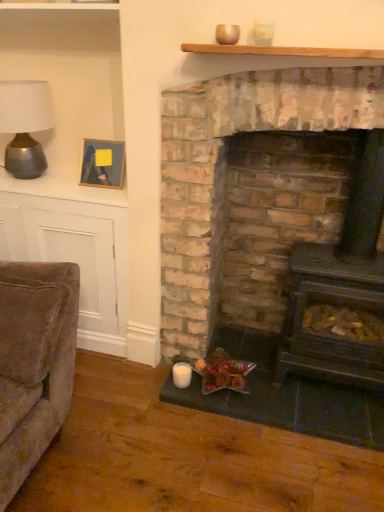
Identify the location of brick fireplace at center. Image resolution: width=384 pixels, height=512 pixels. pyautogui.click(x=259, y=231).

Describe the element at coordinates (103, 163) in the screenshot. This screenshot has height=512, width=384. I see `wooden picture frame at upper left` at that location.

I want to click on shiny brown nuts at lower center, so click(x=223, y=373).

You are a GUI agent. You are given a task and a screenshot of the screen. Output one action in this format:
    pyautogui.click(x=<x>, y=<y>)
    Task: Click on the wooden mantle at upper center
    This screenshot has width=384, height=512.
    Given the screenshot: What is the action you would take?
    pyautogui.click(x=283, y=51)

What is the approximate width of matte silver table lamp at left?

matte silver table lamp at left is 14.82 inches wide.

Image resolution: width=384 pixels, height=512 pixels. In order to click on dark gray cast iron wood burning stove at center in this screenshot , I will do `click(341, 283)`.

This screenshot has height=512, width=384. In order to click on brick fireplace at center in this screenshot , I will do `click(259, 231)`.

From the image's perspective, does shiny brown nuts at lower center appear higher than matte silver table lamp at left?

Actually, shiny brown nuts at lower center appears below matte silver table lamp at left in the image.

How much distance is there between shiny brown nuts at lower center and matte silver table lamp at left?

A distance of 1.33 meters exists between shiny brown nuts at lower center and matte silver table lamp at left.

Which is more to the left, shiny brown nuts at lower center or matte silver table lamp at left?

matte silver table lamp at left is more to the left.

Looking at this image, can you confirm if shiny brown nuts at lower center is smaller than matte silver table lamp at left?

Correct, shiny brown nuts at lower center occupies less space than matte silver table lamp at left.

Which is nearer, (300, 388) or (331, 296)?

Positioned in front is point (331, 296).

Is brick fireplace at center turned away from dark gray cast iron wood burning stove at center?

That's right, brick fireplace at center is facing away from dark gray cast iron wood burning stove at center.

From the image's perspective, is brick fireplace at center above or below dark gray cast iron wood burning stove at center?

Clearly, from the image's perspective, brick fireplace at center is above dark gray cast iron wood burning stove at center.

Considering the sizes of matte silver table lamp at left and shiny brown nuts at lower center in the image, is matte silver table lamp at left bigger or smaller than shiny brown nuts at lower center?

Considering their sizes, matte silver table lamp at left takes up more space than shiny brown nuts at lower center.

In the scene shown: From the image's perspective, between matte silver table lamp at left and shiny brown nuts at lower center, who is located below?

From the image's view, shiny brown nuts at lower center is below.

Looking at this image, does matte silver table lamp at left come in front of shiny brown nuts at lower center?

Yes, the depth of matte silver table lamp at left is less than that of shiny brown nuts at lower center.

Does wooden picture frame at upper left appear on the left side of shiny brown nuts at lower center?

Yes, wooden picture frame at upper left is to the left of shiny brown nuts at lower center.

Find the location of a particular element. food below the wooden picture frame at upper left (from the image's perspective) is located at coordinates (223, 373).

Is wooden picture frame at upper left facing towards shiny brown nuts at lower center?

No.

From a real-world perspective, which is physically above, matte silver table lamp at left or wooden mantle at upper center?

wooden mantle at upper center.

In the scene shown: Would you say matte silver table lamp at left is inside or outside wooden mantle at upper center?

matte silver table lamp at left is spatially situated outside wooden mantle at upper center.

Which object is further away from the camera, matte silver table lamp at left or wooden mantle at upper center?

matte silver table lamp at left is more distant.

Where is `mantle lying in front of the matte silver table lamp at left`? The width and height of the screenshot is (384, 512). mantle lying in front of the matte silver table lamp at left is located at coordinates (283, 51).

From the picture: Are shiny brown nuts at lower center and wooden mantle at upper center beside each other?

shiny brown nuts at lower center is not next to wooden mantle at upper center, and they're not touching.

Does shiny brown nuts at lower center contain wooden mantle at upper center?

No, shiny brown nuts at lower center does not contain wooden mantle at upper center.

Does point (216, 365) lie in front of point (349, 57)?

No, it is behind (349, 57).

Does shiny brown nuts at lower center appear on the left side of wooden mantle at upper center?

Indeed, shiny brown nuts at lower center is positioned on the left side of wooden mantle at upper center.

From the image's perspective, would you say wooden mantle at upper center is shown under brick fireplace at center?

No.

In terms of width, does wooden mantle at upper center look wider or thinner when compared to brick fireplace at center?

wooden mantle at upper center is thinner than brick fireplace at center.

From a real-world perspective, relative to brick fireplace at center, is wooden mantle at upper center vertically above or below?

In terms of real-world spatial position, wooden mantle at upper center is above brick fireplace at center.

Are wooden mantle at upper center and brick fireplace at center beside each other?

wooden mantle at upper center and brick fireplace at center are not in contact.

Where is `table lamp on the left of shiny brown nuts at lower center`? The width and height of the screenshot is (384, 512). table lamp on the left of shiny brown nuts at lower center is located at coordinates (25, 125).

Identify the location of wood burning stove lying on the right of brick fireplace at center. (341, 283).

Looking at the image, which one is located further to dark gray cast iron wood burning stove at center, matte silver table lamp at left or wooden picture frame at upper left?

matte silver table lamp at left is positioned further to the anchor dark gray cast iron wood burning stove at center.

Looking at the image, which one is located further to shiny brown nuts at lower center, matte silver table lamp at left or brick fireplace at center?

matte silver table lamp at left.

Which object lies nearer to the anchor point brick fireplace at center, wooden picture frame at upper left or wooden mantle at upper center?

Among the two, wooden picture frame at upper left is located nearer to brick fireplace at center.

Looking at the image, which one is located further to wooden picture frame at upper left, shiny brown nuts at lower center or dark gray cast iron wood burning stove at center?

Among the two, dark gray cast iron wood burning stove at center is located further to wooden picture frame at upper left.

Based on the photo, considering their positions, is brick fireplace at center positioned closer to wooden picture frame at upper left than matte silver table lamp at left?

Among the two, matte silver table lamp at left is located nearer to wooden picture frame at upper left.

Estimate the real-world distances between objects in this image. Which object is further from dark gray cast iron wood burning stove at center, brick fireplace at center or wooden picture frame at upper left?

wooden picture frame at upper left is positioned further to the anchor dark gray cast iron wood burning stove at center.

From the image, which object appears to be farther from matte silver table lamp at left, wooden picture frame at upper left or brick fireplace at center?

brick fireplace at center lies further to matte silver table lamp at left than the other object.

Based on their spatial positions, is dark gray cast iron wood burning stove at center or brick fireplace at center further from wooden picture frame at upper left?

Among the two, dark gray cast iron wood burning stove at center is located further to wooden picture frame at upper left.

Find the location of a particular element. The image size is (384, 512). picture frame situated between matte silver table lamp at left and brick fireplace at center from left to right is located at coordinates (103, 163).

Locate an element on the screen. The image size is (384, 512). fireplace situated between wooden picture frame at upper left and dark gray cast iron wood burning stove at center from left to right is located at coordinates (259, 231).

This screenshot has height=512, width=384. What are the coordinates of `fireplace between wooden picture frame at upper left and shiny brown nuts at lower center in the up-down direction` in the screenshot? It's located at (259, 231).

You are a GUI agent. You are given a task and a screenshot of the screen. Output one action in this format:
    pyautogui.click(x=<x>, y=<y>)
    Task: Click on the mantle between wooden picture frame at upper left and dark gray cast iron wood burning stove at center from left to right
    This screenshot has width=384, height=512.
    Given the screenshot: What is the action you would take?
    pyautogui.click(x=283, y=51)